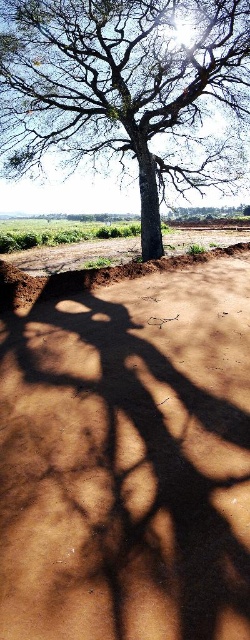
You are standing at the point marked by the coordinates point (128,460), which is the brown sandy soil at center. Looking towards the tree, which direction should you walk to reach the tree?

→ The brown sandy soil at center is located at point (128,460), which is the center of the image. Since the tree is standing prominently in the center, you are already at the tree. Therefore, you don not need to walk in any direction to reach it.

You are a construction worker tasked with placing a 1m by 1m concrete slab. You need to choose between placing it on the brown sandy soil at center or on the dry compacted soil nearby. Based on the scene description, which location would provide a more stable base for the slab?

The brown sandy soil at center is located at point (128, 460), so placing the concrete slab there would be more stable since sandy soil can provide better drainage and stability compared to loose or recently disturbed soil.